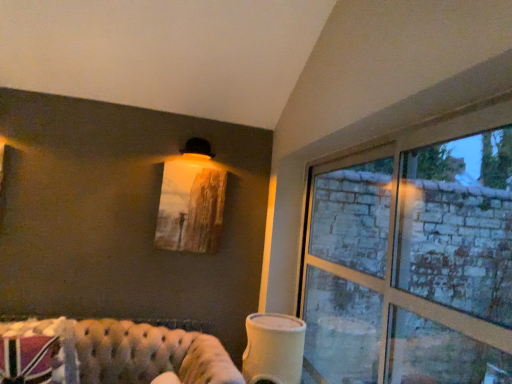
Question: From the image's perspective, is clear glass window at right positioned above or below white matte cup at lower center?

Choices:
 (A) below
 (B) above

Answer: (B)

Question: In terms of height, does clear glass window at right look taller or shorter compared to white matte cup at lower center?

Choices:
 (A) short
 (B) tall

Answer: (B)

Question: Estimate the real-world distances between objects in this image. Which object is closer to the white matte cup at lower center?

Choices:
 (A) matte wooden picture frame at upper center
 (B) clear glass window at right
 (C) tufted leather couch at lower left
 (D) clear glass window at right

Answer: (D)

Question: Considering the real-world distances, which object is farthest from the white matte cup at lower center?

Choices:
 (A) clear glass window at right
 (B) tufted leather couch at lower left
 (C) clear glass window at right
 (D) matte wooden picture frame at upper center

Answer: (D)